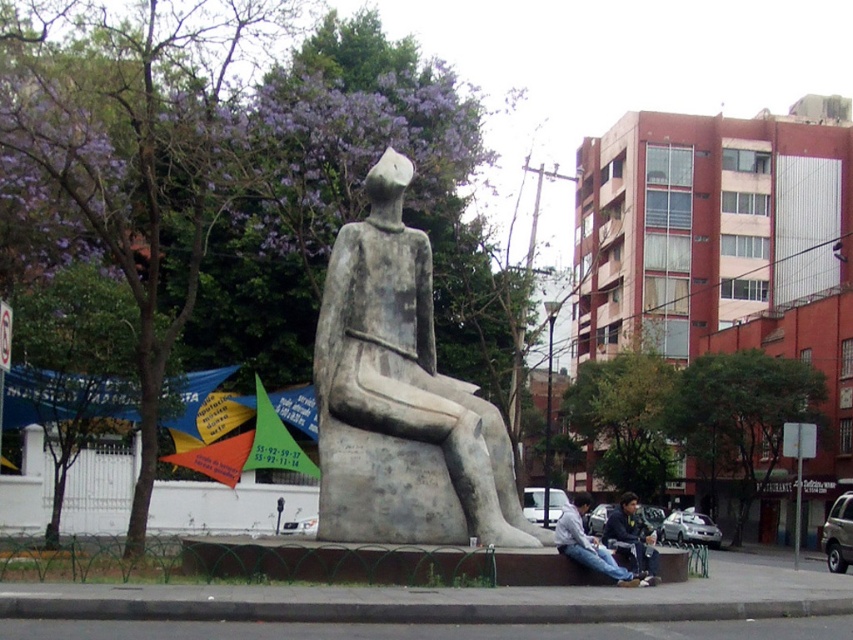
You are a photographer standing in front of the gray stone statue at center and the denim jeans at lower center. You want to capture a photo where both objects are in the frame. Since you can only adjust your zoom, which object should you zoom in on to ensure both are visible?

You should zoom out to ensure both the gray stone statue at center and the denim jeans at lower center are visible in the frame. However, since the gray stone statue at center is taller than the denim jeans at lower center, adjusting the zoom to accommodate the statue will naturally include the jeans within the frame.

You are a delivery person trying to navigate around the gray stone statue at center and the gray concrete curb at lower center. Which object is closer to you, and can you walk around it without stepping on the curb?

The gray stone statue at center is closer to you than the gray concrete curb at lower center. Since the statue is closer, you can walk around it without stepping on the curb as it is farther away.